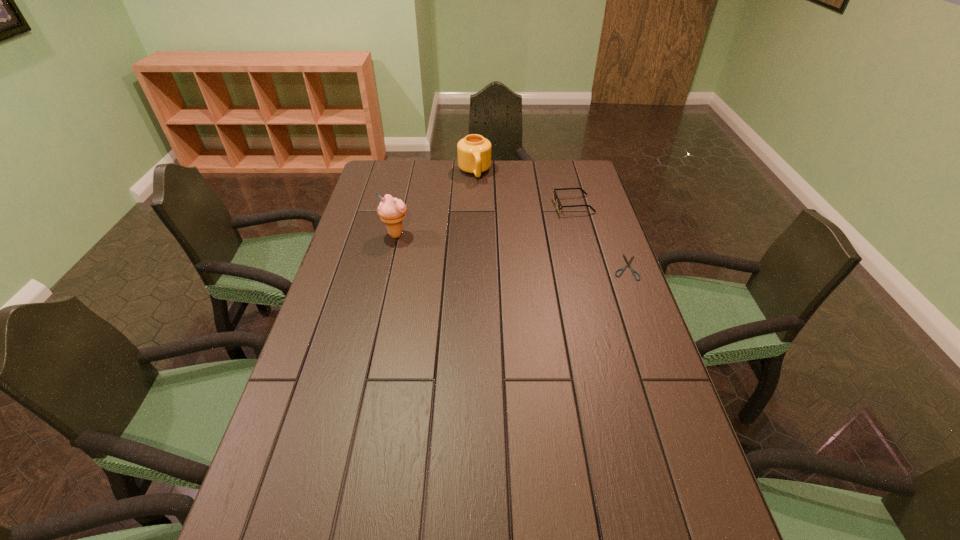
Locate an element on the screen. the tallest object is located at coordinates (391, 210).

Locate an element on the screen. Image resolution: width=960 pixels, height=540 pixels. the leftmost object is located at coordinates 391,210.

The height and width of the screenshot is (540, 960). What are the coordinates of `shears` in the screenshot? It's located at (628, 263).

At what (x,y) coordinates should I click in order to perform the action: click on the shortest object. Please return your answer as a coordinate pair (x, y). The width and height of the screenshot is (960, 540). Looking at the image, I should click on (628, 263).

Locate an element on the screen. This screenshot has height=540, width=960. the third nearest object is located at coordinates (556, 198).

I want to click on the third tallest object, so click(x=556, y=198).

I want to click on the second tallest object, so click(474, 151).

This screenshot has width=960, height=540. I want to click on the second object from left to right, so click(474, 151).

You are a GUI agent. You are given a task and a screenshot of the screen. Output one action in this format:
    pyautogui.click(x=<x>, y=<y>)
    Task: Click on the vacant space located 0.390m on the front of the icecream
    
    Given the screenshot: What is the action you would take?
    click(x=373, y=332)

Find the location of a particular element. The width and height of the screenshot is (960, 540). vacant area located 0.210m on the left of the shears is located at coordinates (546, 267).